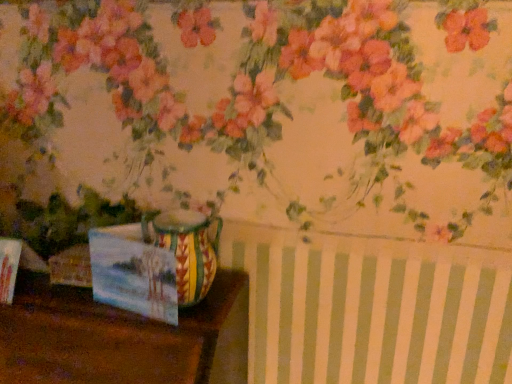
Question: Is matte paper postcard at lower left to the right of multicolored ceramic vase at center from the viewer's perspective?

Choices:
 (A) no
 (B) yes

Answer: (A)

Question: Does matte paper postcard at lower left have a lesser width compared to multicolored ceramic vase at center?

Choices:
 (A) no
 (B) yes

Answer: (B)

Question: Is matte paper postcard at lower left not close to multicolored ceramic vase at center?

Choices:
 (A) yes
 (B) no

Answer: (B)

Question: From the image's perspective, would you say matte paper postcard at lower left is positioned over multicolored ceramic vase at center?

Choices:
 (A) yes
 (B) no

Answer: (B)

Question: Does matte paper postcard at lower left have a lesser height compared to multicolored ceramic vase at center?

Choices:
 (A) yes
 (B) no

Answer: (A)

Question: Which is correct: matte paper postcard at lower left is inside multicolored ceramic vase at center, or outside of it?

Choices:
 (A) outside
 (B) inside

Answer: (B)

Question: Does point (151, 291) appear closer or farther from the camera than point (178, 243)?

Choices:
 (A) farther
 (B) closer

Answer: (A)

Question: Considering the relative positions of matte paper postcard at lower left and multicolored ceramic vase at center in the image provided, is matte paper postcard at lower left to the left or to the right of multicolored ceramic vase at center?

Choices:
 (A) right
 (B) left

Answer: (B)

Question: Looking at the image, does matte paper postcard at lower left seem bigger or smaller compared to multicolored ceramic vase at center?

Choices:
 (A) big
 (B) small

Answer: (B)

Question: Is multicolored ceramic vase at center to the left or to the right of wooden table at lower left in the image?

Choices:
 (A) right
 (B) left

Answer: (A)

Question: Choose the correct answer: Is multicolored ceramic vase at center inside wooden table at lower left or outside it?

Choices:
 (A) inside
 (B) outside

Answer: (B)

Question: Considering the positions of multicolored ceramic vase at center and wooden table at lower left in the image, is multicolored ceramic vase at center wider or thinner than wooden table at lower left?

Choices:
 (A) wide
 (B) thin

Answer: (B)

Question: Is multicolored ceramic vase at center taller or shorter than wooden table at lower left?

Choices:
 (A) short
 (B) tall

Answer: (A)

Question: Does point (145, 269) appear closer or farther from the camera than point (17, 286)?

Choices:
 (A) farther
 (B) closer

Answer: (B)

Question: In the image, is matte paper postcard at lower left on the left side or the right side of wooden table at lower left?

Choices:
 (A) left
 (B) right

Answer: (B)